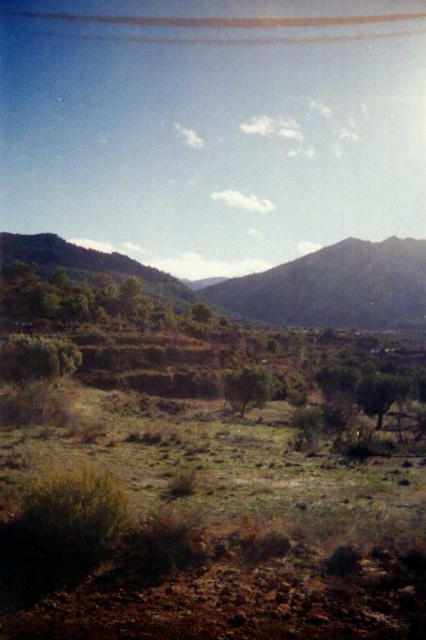
Does point (330, 310) come closer to viewer compared to point (400, 388)?

No, it is not.

Identify the location of green grassy mountain at center. (334, 288).

Is green grassy mountain at center smaller than green leafy tree at center?

No.

Identify the location of green grassy mountain at center. This screenshot has width=426, height=640. (334, 288).

Does green leafy tree at lower left have a lesser height compared to green leafy tree at center-right?

Indeed, green leafy tree at lower left has a lesser height compared to green leafy tree at center-right.

Who is lower down, green leafy tree at lower left or green leafy tree at center-right?

green leafy tree at center-right

Image resolution: width=426 pixels, height=640 pixels. Describe the element at coordinates (37, 356) in the screenshot. I see `green leafy tree at lower left` at that location.

I want to click on green leafy tree at lower left, so click(37, 356).